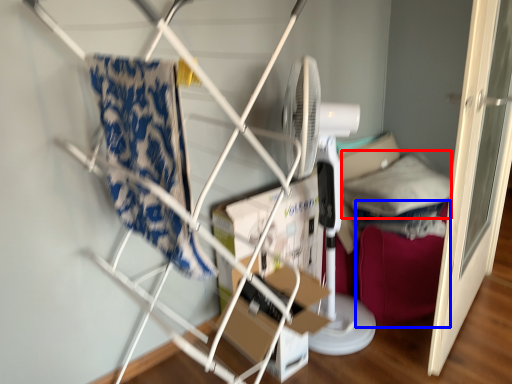
Question: Which point is further to the camera, pillow (highlighted by a red box) or bean bag chair (highlighted by a blue box)?

Choices:
 (A) pillow
 (B) bean bag chair

Answer: (A)